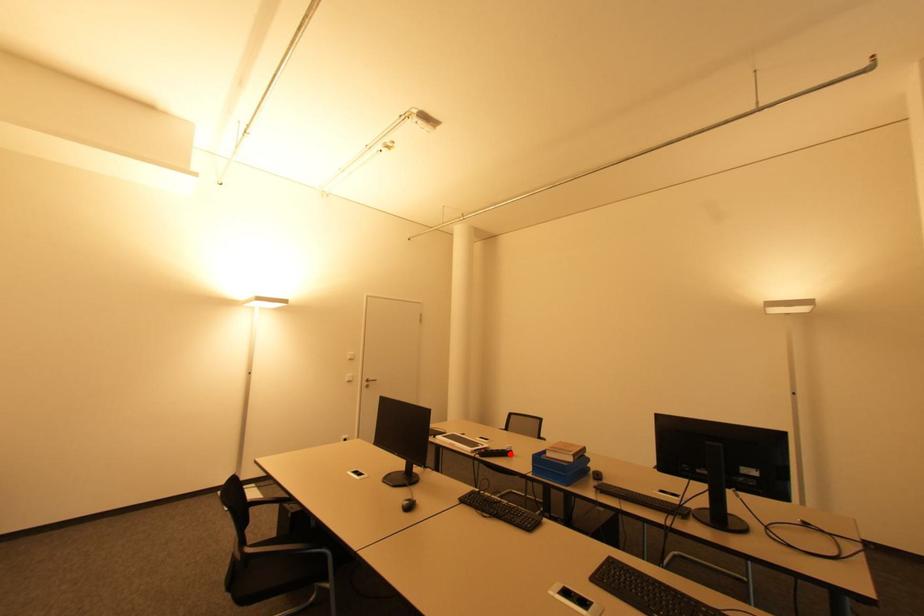
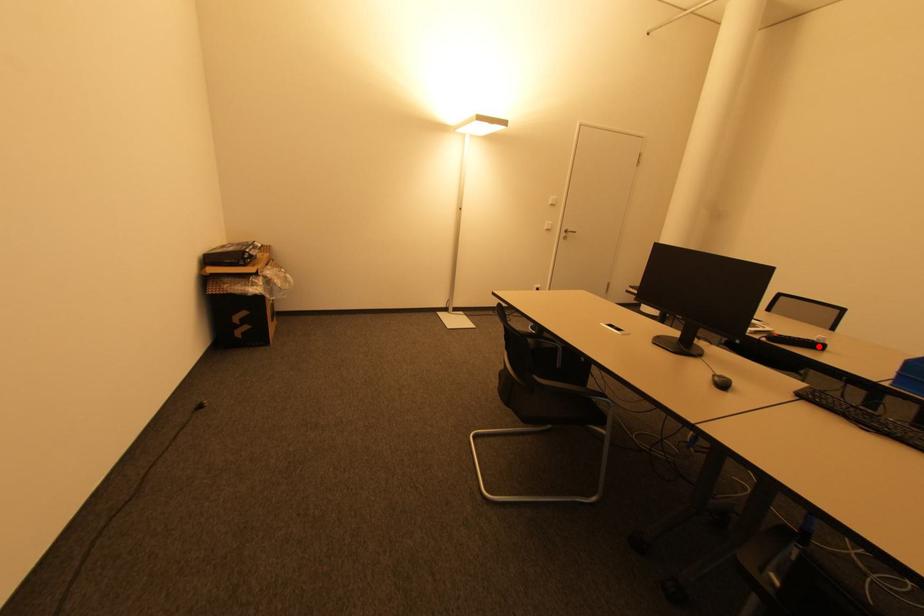
In the scene shown: I am providing you with two images of the same scene from different viewpoints. A red point is marked on the first image and another point is marked on the second image. Is the marked point in image1 the same physical position as the marked point in image2?

Yes